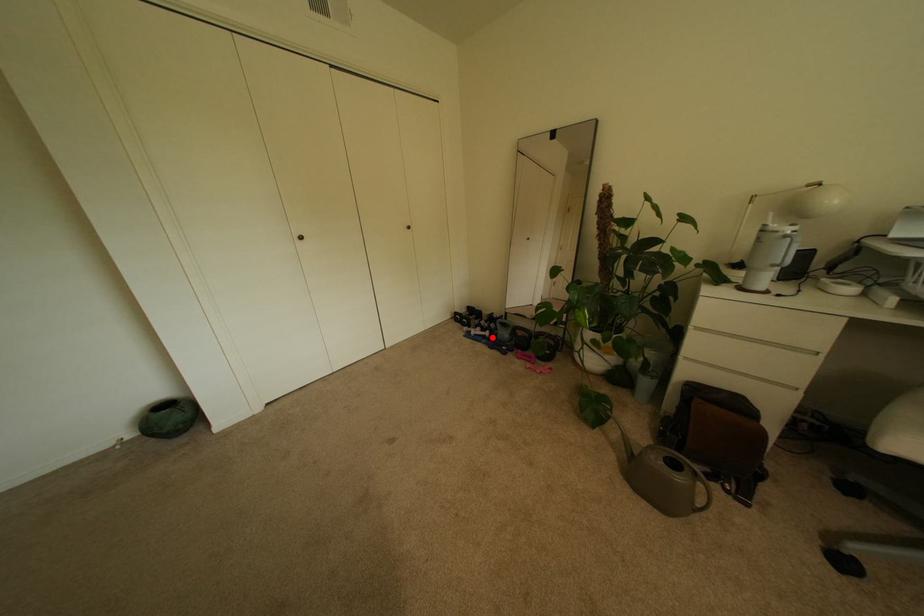
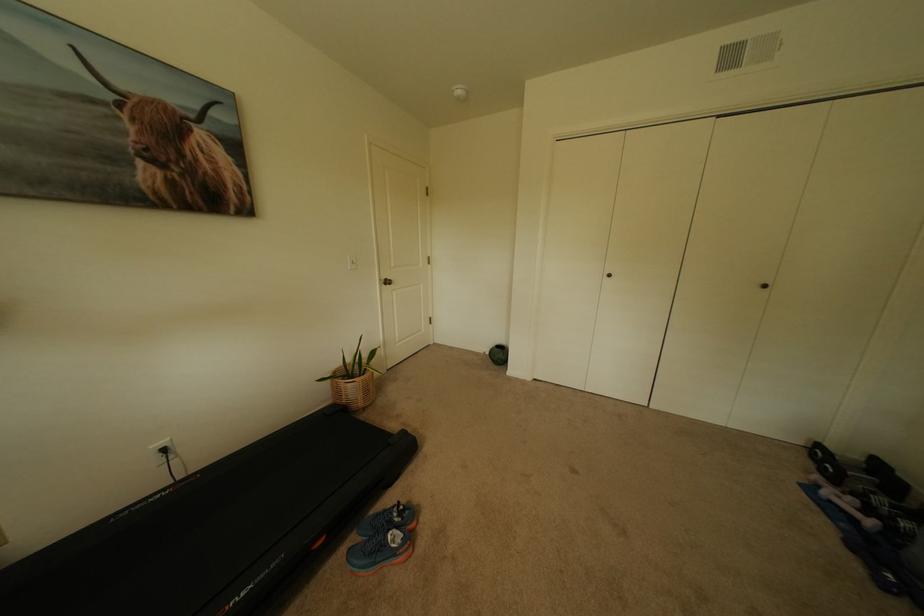
Question: I am providing you with two images of the same scene from different viewpoints. Given a red point in image1, look at the same physical point in image2. Is it:

Choices:
 (A) Closer to the viewpoint
 (B) Farther from the viewpoint

Answer: (A)